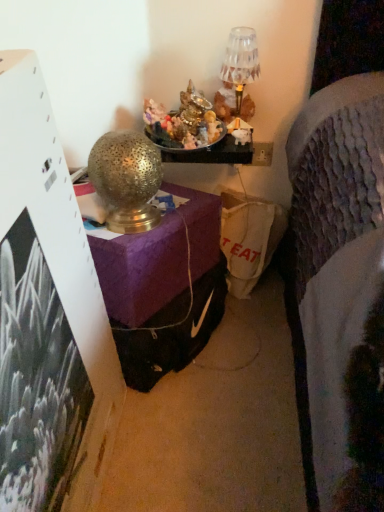
Question: Considering the relative positions of gold textured lamp at upper center, which is the 2th table lamp from top to bottom, and crystal glass table lamp at upper center, acting as the 2th table lamp starting from the bottom, in the image provided, is gold textured lamp at upper center, which is the 2th table lamp from top to bottom, to the left of crystal glass table lamp at upper center, acting as the 2th table lamp starting from the bottom, from the viewer's perspective?

Choices:
 (A) yes
 (B) no

Answer: (A)

Question: Does gold textured lamp at upper center, placed as the 2th table lamp when sorted from right to left, have a greater height compared to crystal glass table lamp at upper center, the first table lamp from the right?

Choices:
 (A) no
 (B) yes

Answer: (B)

Question: Does gold textured lamp at upper center, placed as the 2th table lamp when sorted from right to left, turn towards crystal glass table lamp at upper center, positioned as the 2th table lamp in left-to-right order?

Choices:
 (A) yes
 (B) no

Answer: (B)

Question: Can you confirm if gold textured lamp at upper center, which is the second table lamp from back to front, is shorter than crystal glass table lamp at upper center, which ranks as the 1th table lamp in top-to-bottom order?

Choices:
 (A) yes
 (B) no

Answer: (B)

Question: Does gold textured lamp at upper center, which is the 2th table lamp from top to bottom, have a greater width compared to crystal glass table lamp at upper center, which ranks as the 1th table lamp in back-to-front order?

Choices:
 (A) yes
 (B) no

Answer: (A)

Question: Is gold textured lamp at upper center, the first table lamp when ordered from left to right, bigger than crystal glass table lamp at upper center, which ranks as the 1th table lamp in back-to-front order?

Choices:
 (A) yes
 (B) no

Answer: (A)

Question: Can you confirm if crystal glass table lamp at upper center, the first table lamp from the right, is positioned to the left of gold textured lamp at upper center, which is the 2th table lamp from top to bottom?

Choices:
 (A) no
 (B) yes

Answer: (A)

Question: Could you tell me if crystal glass table lamp at upper center, which ranks as the 1th table lamp in back-to-front order, is facing gold textured lamp at upper center, the first table lamp when ordered from left to right?

Choices:
 (A) yes
 (B) no

Answer: (B)

Question: Is crystal glass table lamp at upper center, placed as the second table lamp when sorted from front to back, positioned far away from gold textured lamp at upper center, which ranks as the 1th table lamp in front-to-back order?

Choices:
 (A) no
 (B) yes

Answer: (A)

Question: From a real-world perspective, is crystal glass table lamp at upper center, which ranks as the 1th table lamp in top-to-bottom order, over gold textured lamp at upper center, placed as the 2th table lamp when sorted from right to left?

Choices:
 (A) yes
 (B) no

Answer: (A)

Question: From a real-world perspective, is crystal glass table lamp at upper center, the first table lamp from the right, beneath gold textured lamp at upper center, which is the second table lamp from back to front?

Choices:
 (A) no
 (B) yes

Answer: (A)

Question: Is crystal glass table lamp at upper center, the first table lamp from the right, smaller than gold textured lamp at upper center, which is the 2th table lamp from top to bottom?

Choices:
 (A) no
 (B) yes

Answer: (B)

Question: In terms of size, does gold textured lamp at upper center, which ranks as the 1th table lamp in front-to-back order, appear bigger or smaller than crystal glass table lamp at upper center, acting as the 2th table lamp starting from the bottom?

Choices:
 (A) big
 (B) small

Answer: (A)